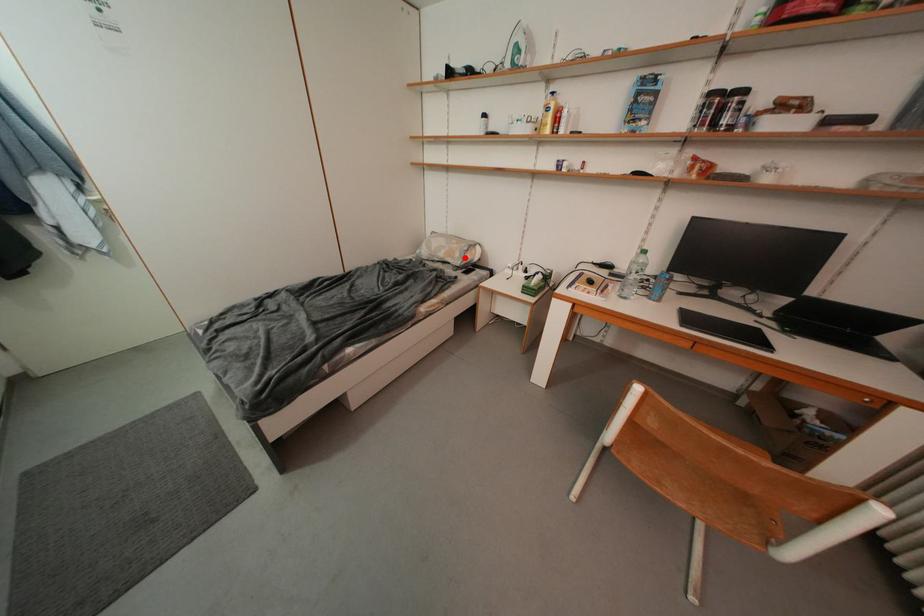
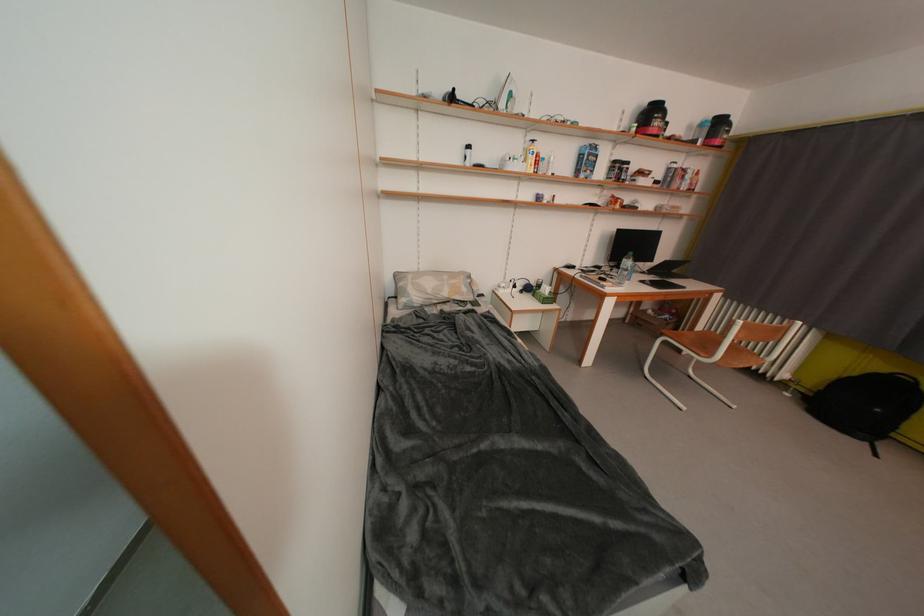
The point at the highlighted location is marked in the first image. Where is the corresponding point in the second image?

(471, 293)